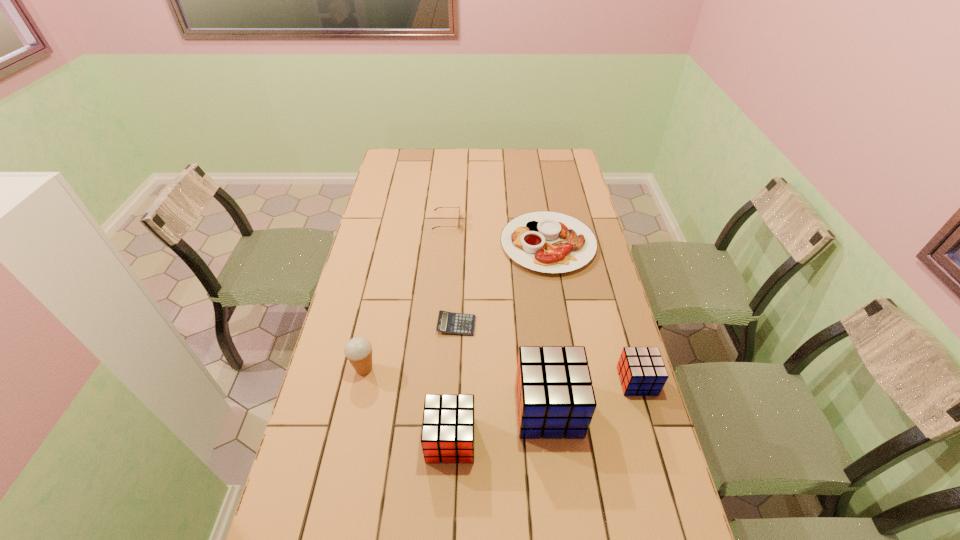
I want to click on free area in between the shortest cube and the sixth tallest object, so click(592, 313).

Image resolution: width=960 pixels, height=540 pixels. In order to click on empty space that is in between the sixth tallest object and the second tallest cube in this screenshot , I will do `click(499, 342)`.

Where is `empty space that is in between the shortest object and the sunglasses`? empty space that is in between the shortest object and the sunglasses is located at coordinates (451, 273).

Locate an element on the screen. free space between the platter and the shortest object is located at coordinates (502, 285).

Find the location of `object that is the sixth closest to the platter`. object that is the sixth closest to the platter is located at coordinates (448, 428).

Locate an element on the screen. The image size is (960, 540). the closest object to the tallest cube is located at coordinates (448, 428).

Locate which cube ranks third in proximity to the leftmost object. Please provide its 2D coordinates. Your answer should be formatted as a tuple, i.e. [(x, y)], where the tuple contains the x and y coordinates of a point satisfying the conditions above.

[(642, 372)]

Select which cube appears as the closest to the platter. Please provide its 2D coordinates. Your answer should be formatted as a tuple, i.e. [(x, y)], where the tuple contains the x and y coordinates of a point satisfying the conditions above.

[(642, 372)]

Where is `free space that satisfies the following two spatial constraints: 1. on the back side of the fourth shortest object; 2. on the lenses of the sunglasses`? Image resolution: width=960 pixels, height=540 pixels. free space that satisfies the following two spatial constraints: 1. on the back side of the fourth shortest object; 2. on the lenses of the sunglasses is located at coordinates (591, 222).

You are a GUI agent. You are given a task and a screenshot of the screen. Output one action in this format:
    pyautogui.click(x=<x>, y=<y>)
    Task: Click on the free spot that satisfies the following two spatial constraints: 1. on the lenses of the tallest cube; 2. on the left side of the sunglasses
    This screenshot has width=960, height=540.
    Given the screenshot: What is the action you would take?
    pyautogui.click(x=431, y=409)